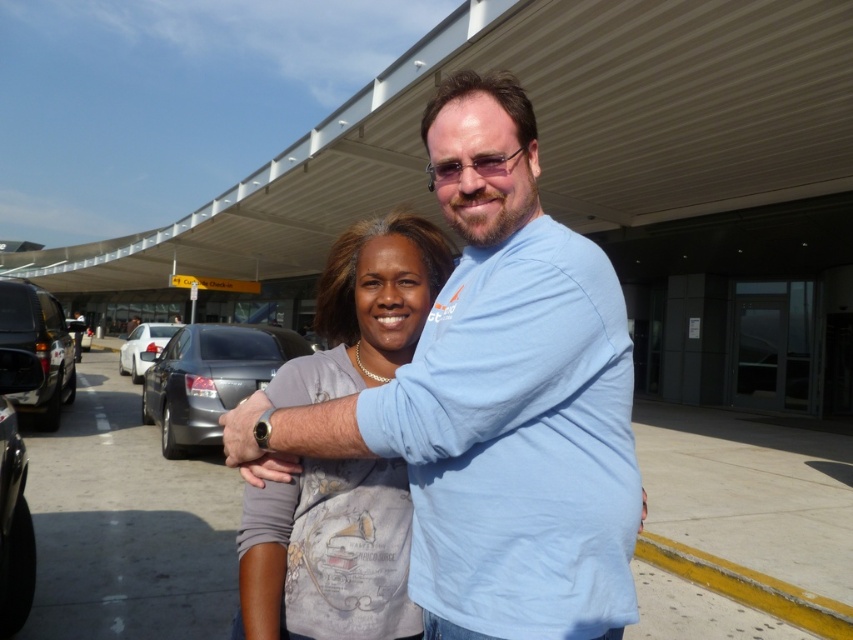
You are a valet parking attendant who needs to park both the matte black suv at left and the shiny black car at left in a parking spot that is 5 meters long. Which vehicle should be parked first to ensure both can fit?

The matte black suv at left has a smaller size compared to shiny black car at left, so you should park the matte black suv at left first to ensure both can fit in the 5 meters long parking spot.

You are a photographer positioned at the airport terminal entrance. You want to capture a photo of the matte gray shirt at center and the matte black suv at left. Which object will appear larger in your photo?

The matte gray shirt at center will appear larger in the photo because it is closer to the viewer than the matte black suv at left.